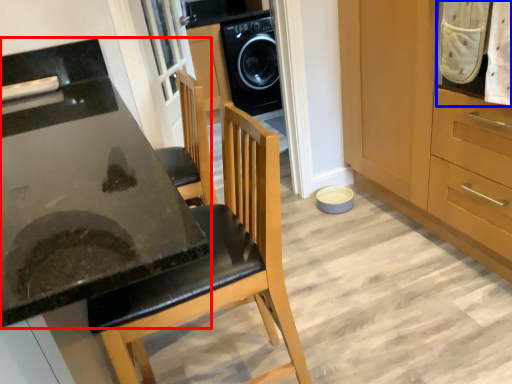
Question: Which point is closer to the camera, countertop (highlighted by a red box) or laundry (highlighted by a blue box)?

Choices:
 (A) countertop
 (B) laundry

Answer: (A)